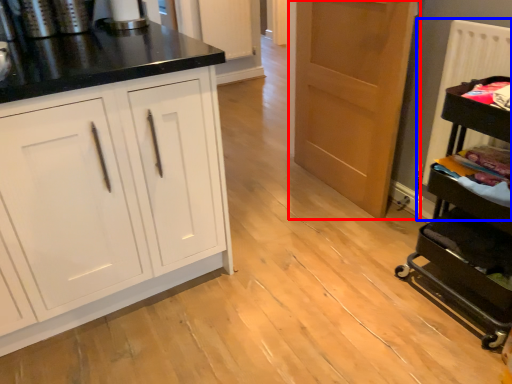
Question: Among these objects, which one is nearest to the camera, door (highlighted by a red box) or radiator (highlighted by a blue box)?

Choices:
 (A) door
 (B) radiator

Answer: (B)